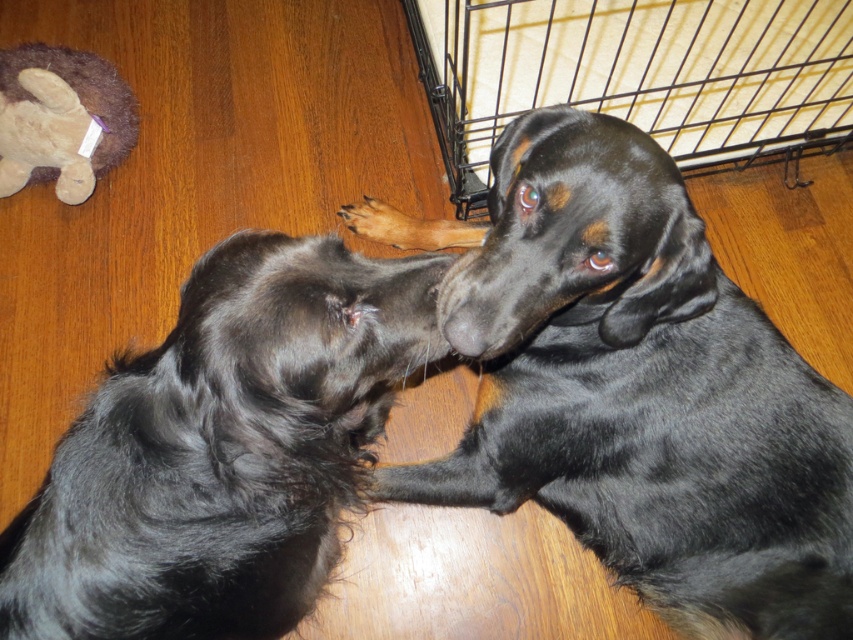
Is shiny black fur at center below fuzzy brown stuffed animal at upper left?

Indeed, shiny black fur at center is positioned under fuzzy brown stuffed animal at upper left.

Does shiny black fur at center appear over fuzzy brown stuffed animal at upper left?

No.

Which is in front, point (355, 289) or point (90, 90)?

Point (355, 289) is in front.

Where is `shiny black fur at center`? shiny black fur at center is located at coordinates coord(223,449).

Is shiny black fur at center to the left of black wire cage at lower right from the viewer's perspective?

Indeed, shiny black fur at center is positioned on the left side of black wire cage at lower right.

From the picture: Is shiny black fur at center closer to camera compared to black wire cage at lower right?

That is True.

Is point (358, 413) positioned after point (776, 1)?

No, it is in front of (776, 1).

At what (x,y) coordinates should I click in order to perform the action: click on shiny black fur at center. Please return your answer as a coordinate pair (x, y). The height and width of the screenshot is (640, 853). Looking at the image, I should click on (223, 449).

Does black shiny fur dog at center appear under fuzzy brown stuffed animal at upper left?

Indeed, black shiny fur dog at center is positioned under fuzzy brown stuffed animal at upper left.

Between black shiny fur dog at center and fuzzy brown stuffed animal at upper left, which one has less height?

fuzzy brown stuffed animal at upper left is shorter.

Locate an element on the screen. Image resolution: width=853 pixels, height=640 pixels. black shiny fur dog at center is located at coordinates (636, 387).